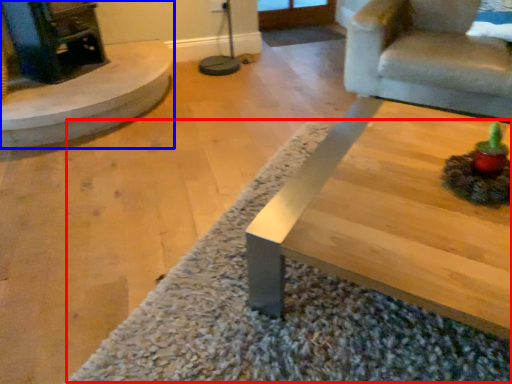
Question: Which of the following is the farthest to the observer, mat (highlighted by a red box) or fireplace (highlighted by a blue box)?

Choices:
 (A) mat
 (B) fireplace

Answer: (B)